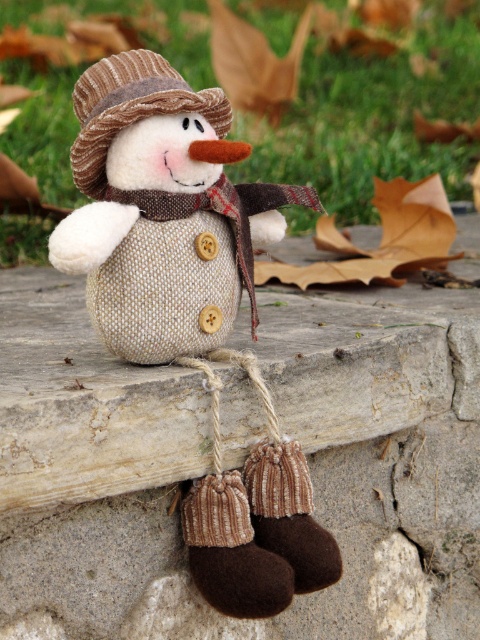
Is burlap fabric snowman at center shorter than brown textured hat at center?

No, burlap fabric snowman at center is not shorter than brown textured hat at center.

Does burlap fabric snowman at center appear over brown textured hat at center?

No, burlap fabric snowman at center is not above brown textured hat at center.

Where is `burlap fabric snowman at center`? The width and height of the screenshot is (480, 640). burlap fabric snowman at center is located at coordinates (210, 460).

The image size is (480, 640). What do you see at coordinates (210, 460) in the screenshot? I see `burlap fabric snowman at center` at bounding box center [210, 460].

Between burlap fabric snowman at center and burlap snowman at center, which one is positioned lower?

burlap snowman at center is lower down.

Is point (126, 621) farther from viewer compared to point (172, 250)?

Yes, it is behind point (172, 250).

I want to click on burlap fabric snowman at center, so click(210, 460).

Is burlap snowman at center bigger than brown textured hat at center?

Yes, burlap snowman at center is bigger than brown textured hat at center.

Is burlap snowman at center positioned behind brown textured hat at center?

That is False.

This screenshot has width=480, height=640. In order to click on burlap snowman at center in this screenshot , I will do `click(191, 307)`.